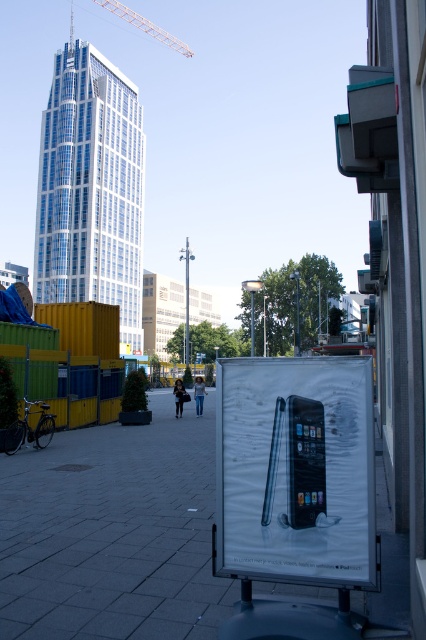
Image resolution: width=426 pixels, height=640 pixels. What do you see at coordinates (114, 532) in the screenshot?
I see `smooth concrete pavement at center` at bounding box center [114, 532].

Who is lower down, smooth concrete pavement at center or metallic silver phone at center?

smooth concrete pavement at center

Does point (386, 508) come closer to viewer compared to point (333, 416)?

No, it is behind (333, 416).

At what (x,y) coordinates should I click in order to perform the action: click on smooth concrete pavement at center. Please return your answer as a coordinate pair (x, y). Looking at the image, I should click on (114, 532).